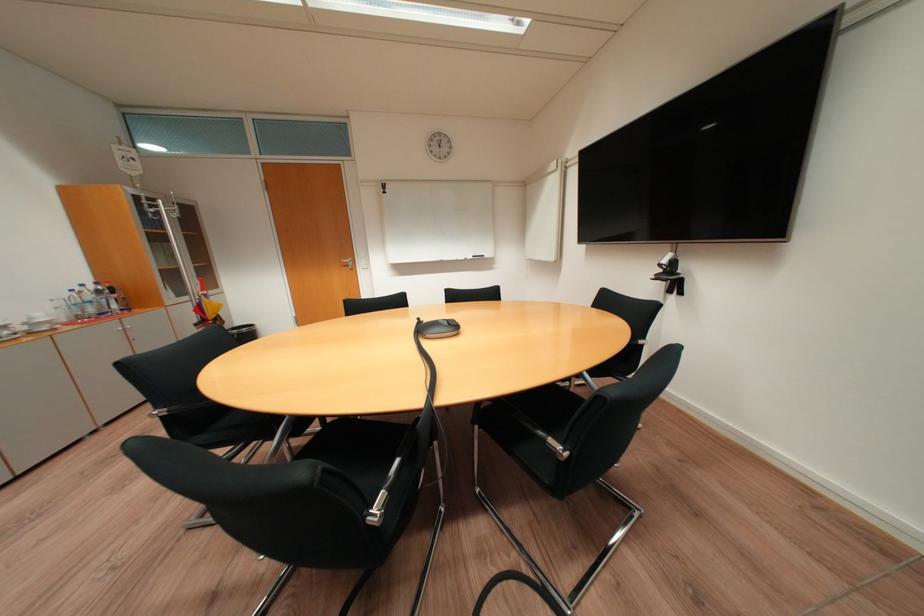
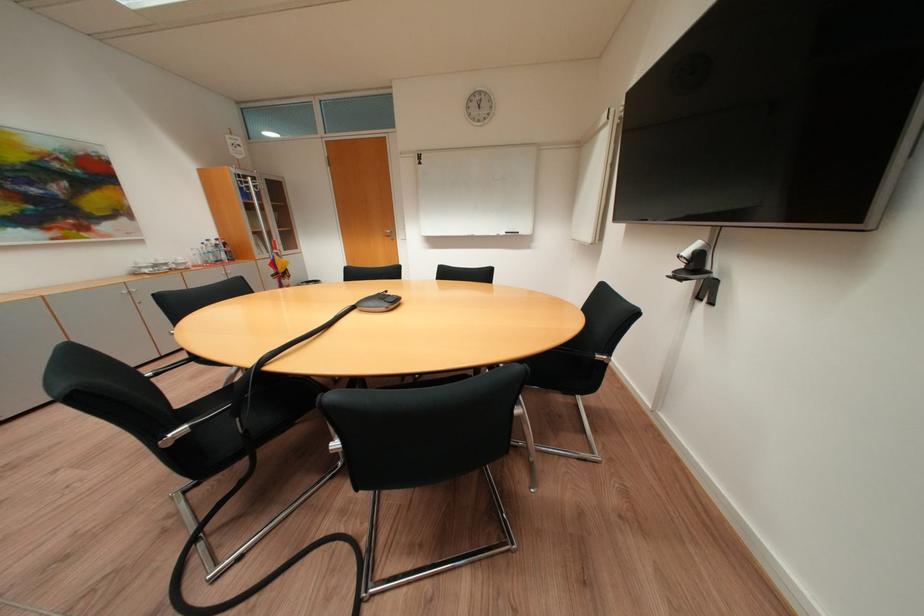
Question: How did the camera likely rotate?

Choices:
 (A) Left
 (B) Right
 (C) Up
 (D) Down

Answer: (A)